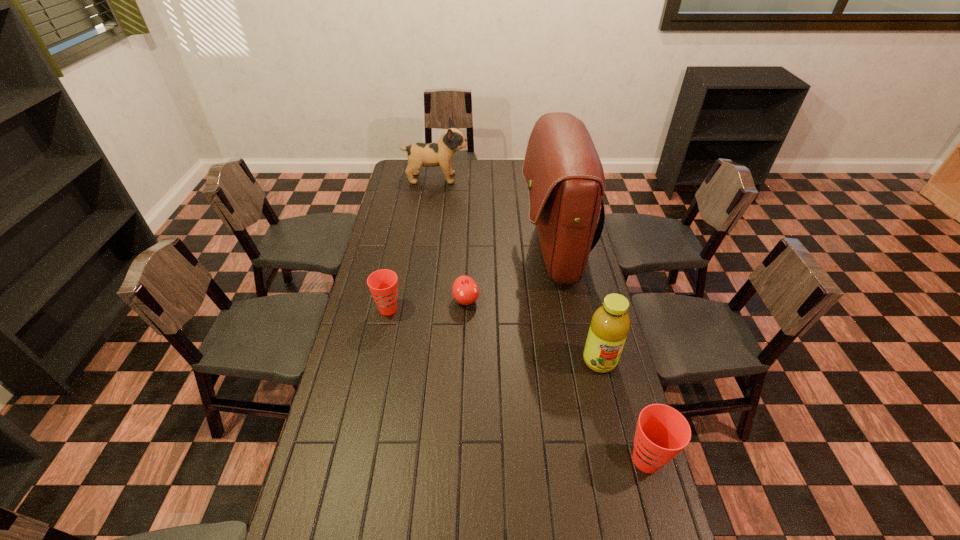
Where is `spot to insert another cup for uniform distribution`? spot to insert another cup for uniform distribution is located at coordinates (498, 374).